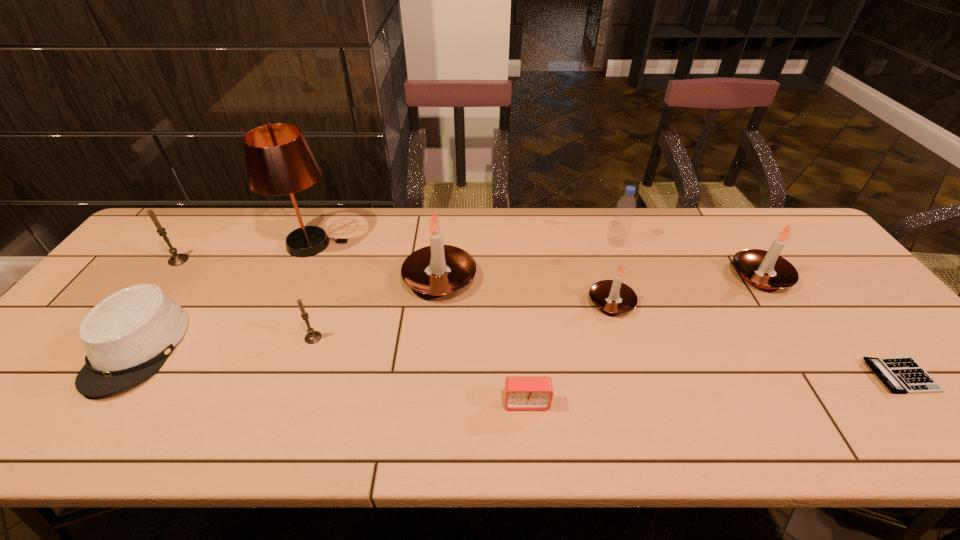
Locate an element on the screen. This screenshot has width=960, height=540. hat that is at the left edge is located at coordinates (128, 336).

You are a GUI agent. You are given a task and a screenshot of the screen. Output one action in this format:
    pyautogui.click(x=<x>, y=<y>)
    Task: Click on the candle present at the right edge
    
    Given the screenshot: What is the action you would take?
    pyautogui.click(x=752, y=264)

Where is `calculator located at the right edge`? calculator located at the right edge is located at coordinates (903, 375).

What are the coordinates of `vacant space at the far edge of the desktop` in the screenshot? It's located at coord(222,239).

In the image, there is a desktop. Identify the location of free region at the near edge. (389, 428).

Locate an element on the screen. This screenshot has width=960, height=540. vacant space at the left edge of the desktop is located at coordinates (142, 262).

The height and width of the screenshot is (540, 960). Identify the location of free spot at the right edge of the desktop. (839, 314).

Where is `vacant space at the far right corner of the desktop`? This screenshot has width=960, height=540. vacant space at the far right corner of the desktop is located at coordinates (763, 240).

Where is `vacant space at the near right corner`? vacant space at the near right corner is located at coordinates (923, 447).

In order to click on unoccupied area between the second candle from right to left and the ninth object from left to right in this screenshot , I will do `click(686, 289)`.